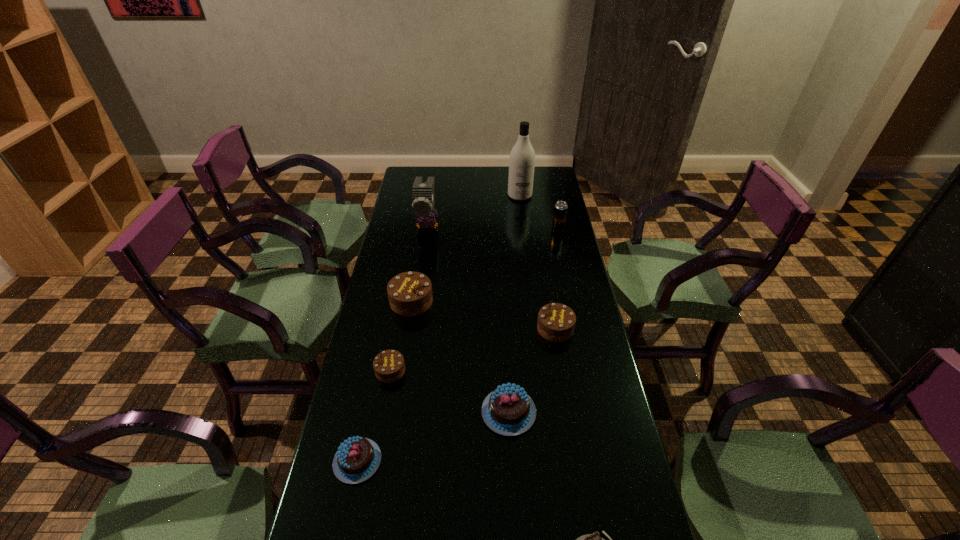
You are a GUI agent. You are given a task and a screenshot of the screen. Output one action in this format:
    pyautogui.click(x=<x>, y=<y>)
    Task: Click on the blank area located 0.200m on the right of the eighth farthest object
    The width and height of the screenshot is (960, 540).
    Given the screenshot: What is the action you would take?
    pyautogui.click(x=461, y=461)

Find the location of `object located at the far edge`. object located at the far edge is located at coordinates (522, 156).

You are a GUI agent. You are given a task and a screenshot of the screen. Output one action in this format:
    pyautogui.click(x=<x>, y=<y>)
    Task: Click on the bird that is at the left edge
    
    Given the screenshot: What is the action you would take?
    pyautogui.click(x=422, y=193)

This screenshot has height=540, width=960. Identify the location of shampoo that is at the right edge. (522, 156).

Where is `beer can that is at the right edge`? beer can that is at the right edge is located at coordinates (560, 211).

What are the coordinates of `chocolate cake that is at the right edge` in the screenshot? It's located at (556, 322).

Identify the location of object that is at the far right corner. (522, 156).

Locate an element on the screen. The height and width of the screenshot is (540, 960). free spot at the far edge of the desktop is located at coordinates (494, 171).

Locate an element on the screen. This screenshot has width=960, height=540. vacant space at the left edge of the desktop is located at coordinates (382, 269).

Locate an element on the screen. The image size is (960, 540). vacant space at the right edge is located at coordinates (585, 342).